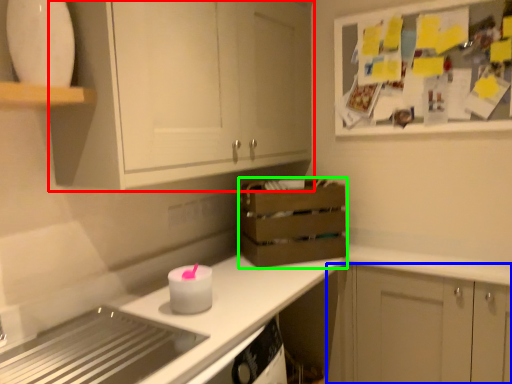
Question: Which object is positioned farthest from cabinetry (highlighted by a red box)? Select from cabinetry (highlighted by a blue box) and crate (highlighted by a green box).

Choices:
 (A) cabinetry
 (B) crate

Answer: (A)